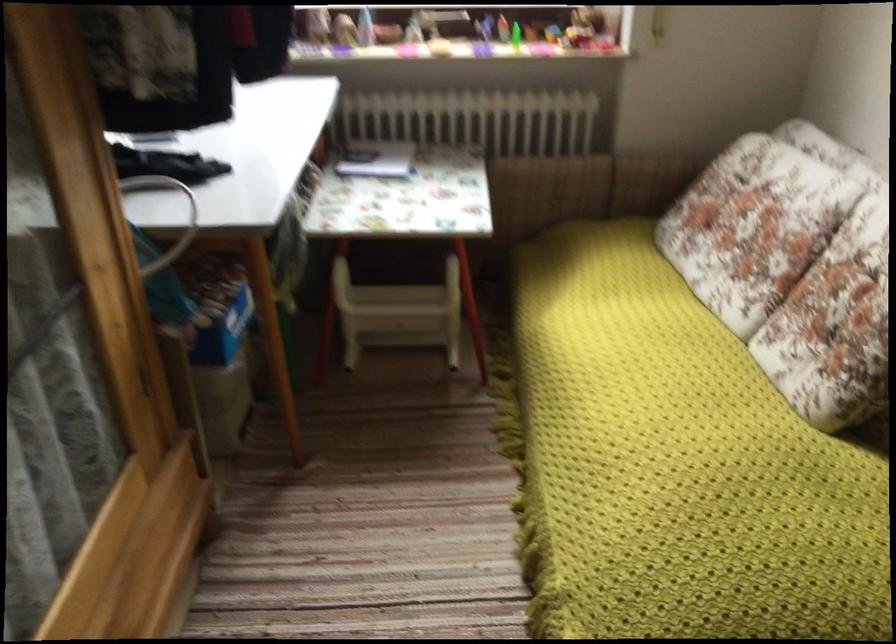
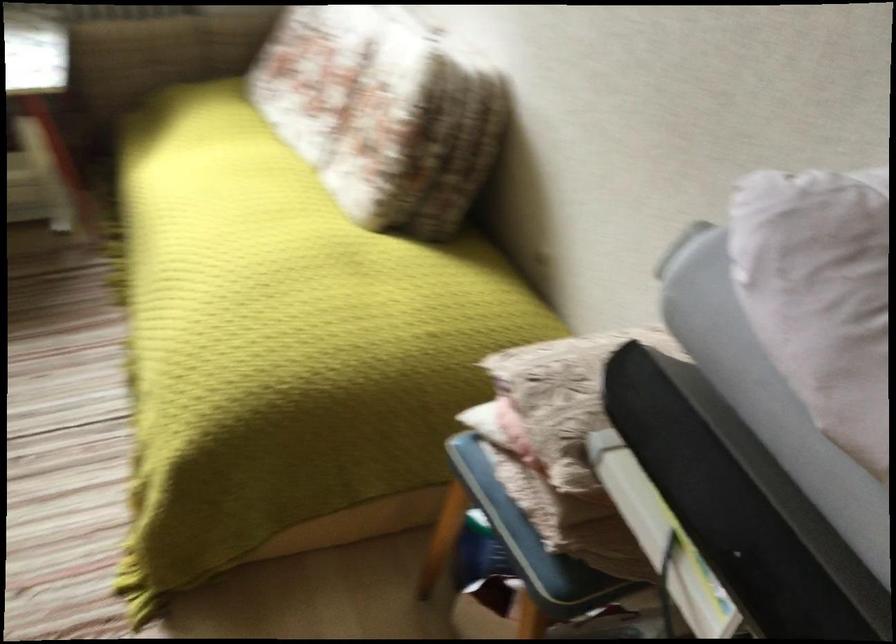
Question: The camera is either moving clockwise (left) or counter-clockwise (right) around the object. The first image is from the beginning of the video and the second image is from the end. Is the camera moving left or right when shooting the video?

Choices:
 (A) Left
 (B) Right

Answer: (A)